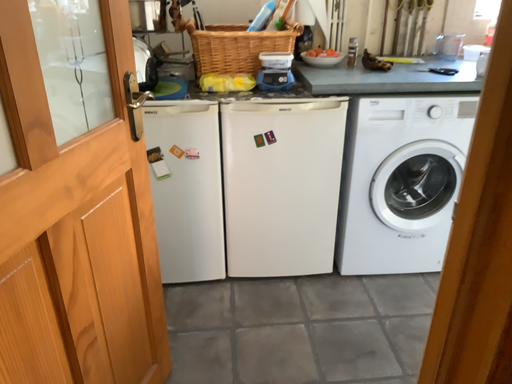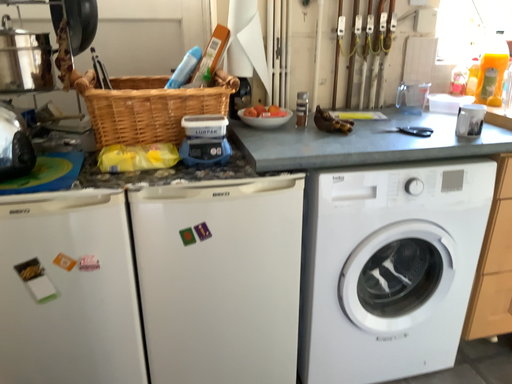
Question: How did the camera likely rotate when shooting the video?

Choices:
 (A) rotated right
 (B) rotated left

Answer: (A)